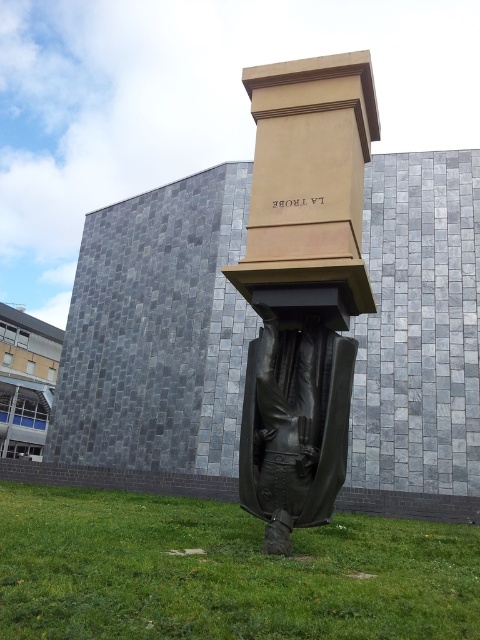
Which is more to the left, green grass at lower center or black polished statue at center?

green grass at lower center

Which of these two, green grass at lower center or black polished statue at center, stands shorter?

black polished statue at center is shorter.

Locate an element on the screen. Image resolution: width=480 pixels, height=640 pixels. green grass at lower center is located at coordinates (224, 572).

Where is `green grass at lower center`? The image size is (480, 640). green grass at lower center is located at coordinates (224, 572).